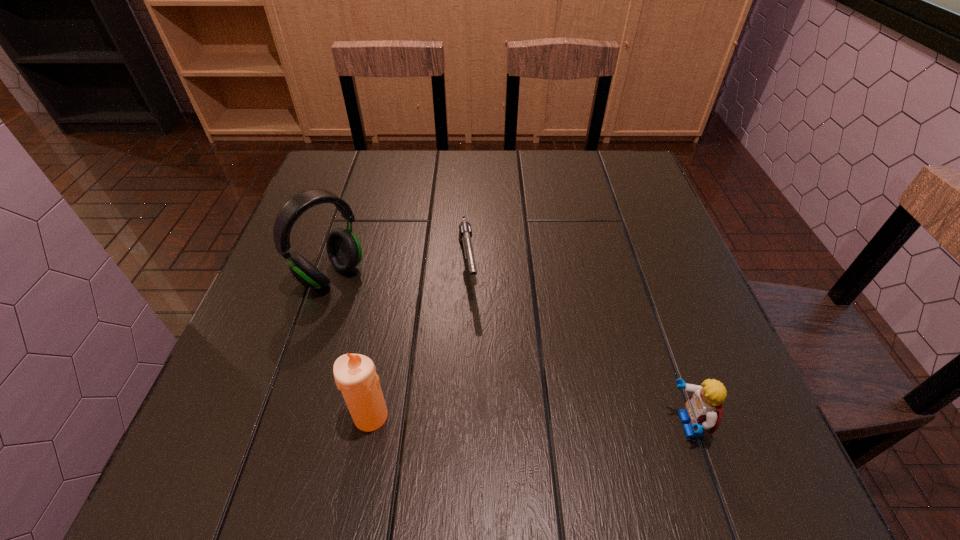
The image size is (960, 540). What are the coordinates of `the second object from left to right` in the screenshot? It's located at [x=355, y=375].

The height and width of the screenshot is (540, 960). I want to click on the third tallest object, so click(703, 411).

The height and width of the screenshot is (540, 960). In order to click on the rightmost object in this screenshot , I will do `click(703, 411)`.

Find the location of a particular element. The image size is (960, 540). headset is located at coordinates (344, 251).

You are a GUI agent. You are given a task and a screenshot of the screen. Output one action in this format:
    pyautogui.click(x=<x>, y=<y>)
    Task: Click on the shortest object
    Image resolution: width=960 pixels, height=540 pixels.
    Given the screenshot: What is the action you would take?
    pyautogui.click(x=465, y=232)

The height and width of the screenshot is (540, 960). In order to click on the third object from left to right in this screenshot , I will do `click(465, 232)`.

Locate an element on the screen. This screenshot has width=960, height=540. blank space located on the back of the second object from left to right is located at coordinates (380, 364).

Where is `vacant area situated 0.210m on the front-facing side of the third tallest object`? The width and height of the screenshot is (960, 540). vacant area situated 0.210m on the front-facing side of the third tallest object is located at coordinates (537, 425).

You are a GUI agent. You are given a task and a screenshot of the screen. Output one action in this format:
    pyautogui.click(x=<x>, y=<y>)
    Task: Click on the vacant area situated on the front-facing side of the third tallest object
    This screenshot has height=540, width=960.
    Given the screenshot: What is the action you would take?
    pyautogui.click(x=599, y=425)

The height and width of the screenshot is (540, 960). What are the coordinates of `vacant space located 0.280m on the front-facing side of the third tallest object` in the screenshot? It's located at (493, 425).